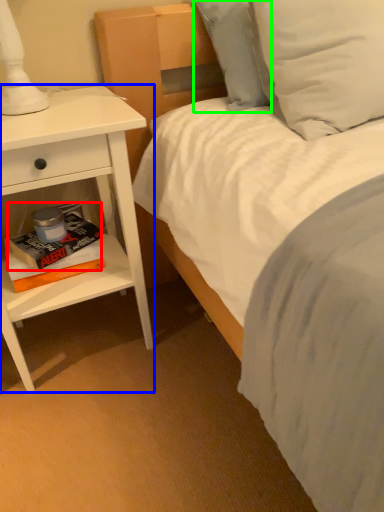
Question: Which object is positioned closest to paperback book (highlighted by a red box)? Select from nightstand (highlighted by a blue box) and pillow (highlighted by a green box).

Choices:
 (A) nightstand
 (B) pillow

Answer: (A)